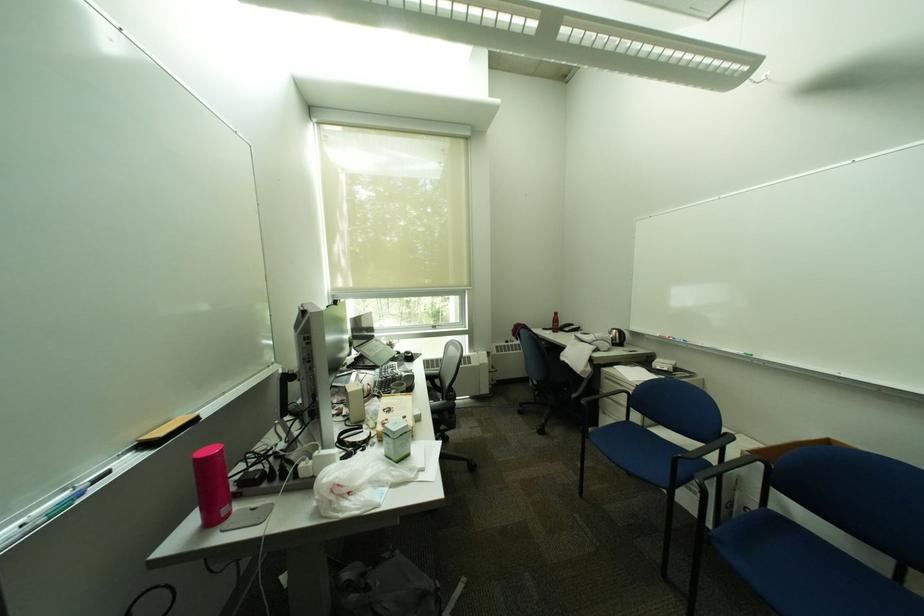
What do you see at coordinates (154, 598) in the screenshot?
I see `the cabinet drawer handle` at bounding box center [154, 598].